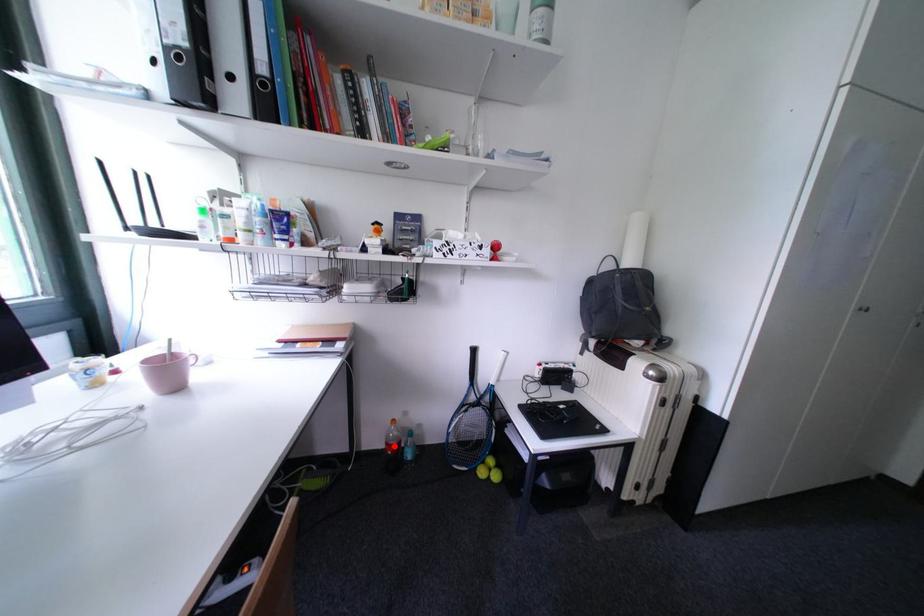
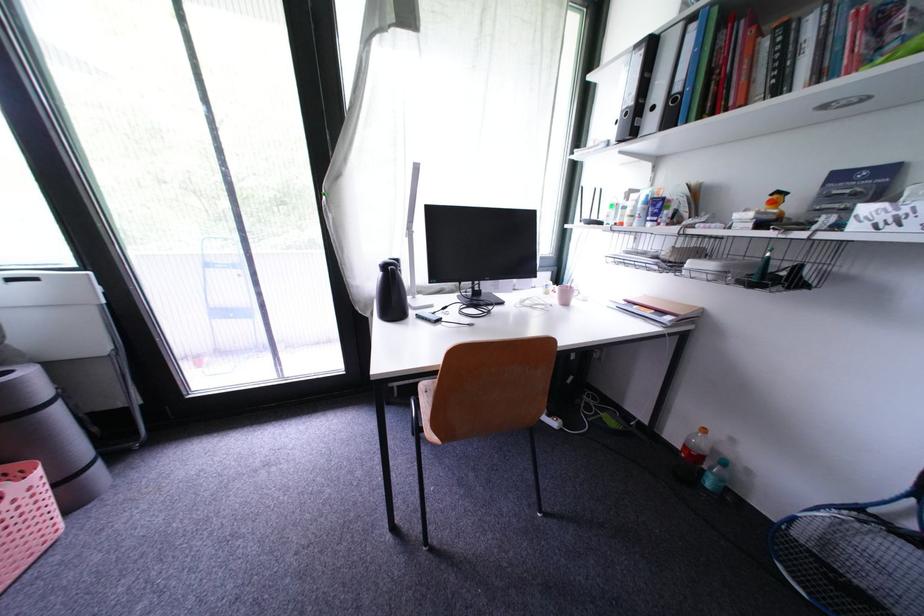
Where in the second image is the point corresponding to the highlighted location from the first image?

(694, 448)